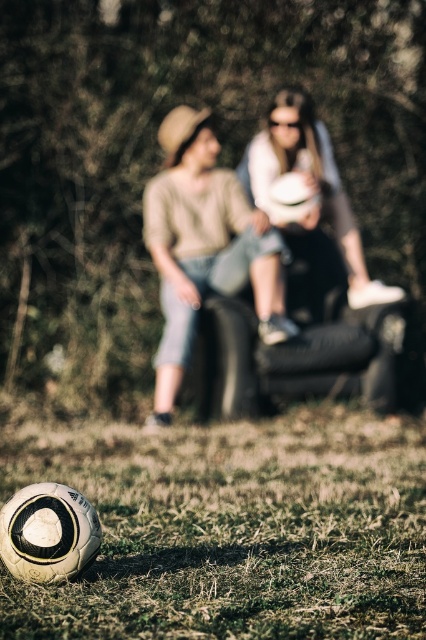
Question: Is white matte soccer ball at lower left smaller than denim jeans at center?

Choices:
 (A) no
 (B) yes

Answer: (A)

Question: Which of these objects is positioned closest to the matte white ball at center?

Choices:
 (A) denim jeans at center
 (B) white matte soccer ball at lower left

Answer: (A)

Question: Which object appears farthest from the camera in this image?

Choices:
 (A) white matte soccer ball at lower left
 (B) matte white ball at center
 (C) denim jeans at center

Answer: (B)

Question: Which point is closer to the camera?

Choices:
 (A) white matte soccer ball at lower left
 (B) denim jeans at center
 (C) matte white ball at center

Answer: (A)

Question: Is white matte soccer ball at lower left thinner than matte white ball at center?

Choices:
 (A) yes
 (B) no

Answer: (B)

Question: Is white matte soccer ball at lower left above denim jeans at center?

Choices:
 (A) yes
 (B) no

Answer: (B)